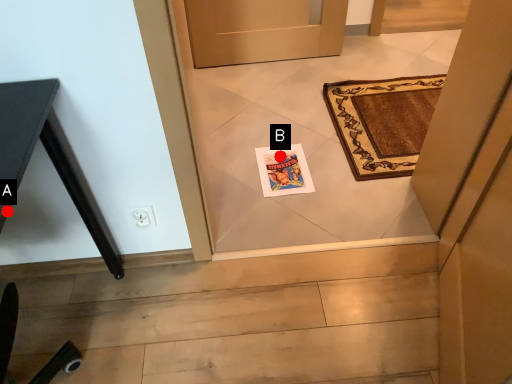
Question: Two points are circled on the image, labeled by A and B beside each circle. Which point appears closest to the camera in this image?

Choices:
 (A) A is closer
 (B) B is closer

Answer: (A)